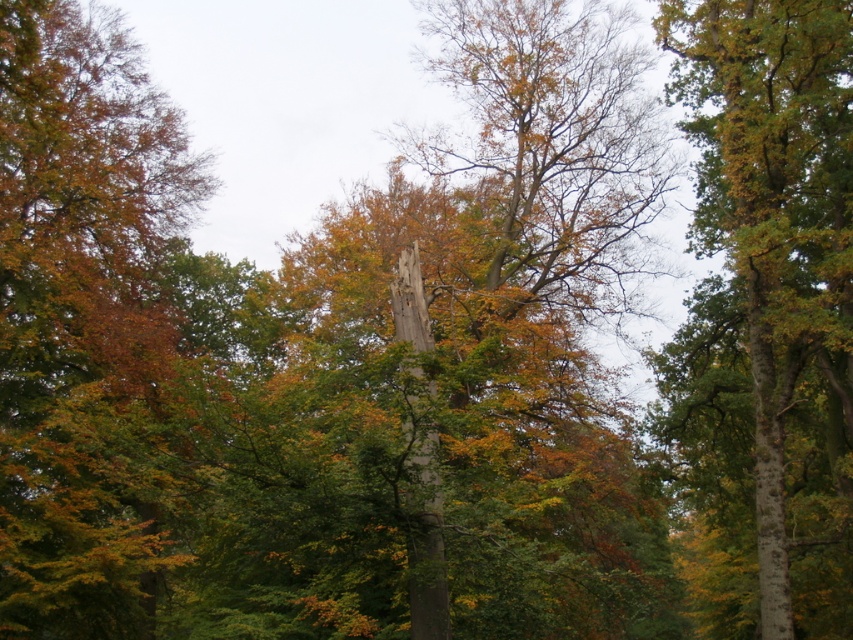
You are a bird looking for a nesting spot. You see the green leafy tree at left and the smooth gray totem pole at center. Which one is taller and would be a better option for nesting?

The green leafy tree at left is taller than the smooth gray totem pole at center, so it would be a better option for nesting.

You are an observer in the forest scene. You see the green leafy tree at left and the smooth gray totem pole at center. Which object is closer to you?

The green leafy tree at left is closer to you because it is in front of the smooth gray totem pole at center.

You are a bird looking for a place to perch. You see the green leafy tree at left and the green smooth bark tree at center. Which tree is positioned lower in the scene?

The green leafy tree at left is located below the green smooth bark tree at center, so it is positioned lower in the scene.